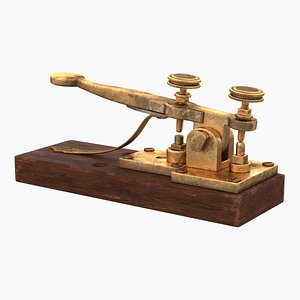
What are the coordinates of `corner` in the screenshot? It's located at (239, 196), (281, 173), (282, 200), (14, 155), (16, 180), (69, 138), (119, 157), (120, 166), (171, 181), (172, 172).